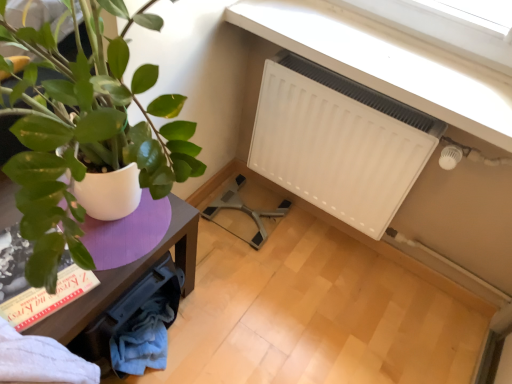
The height and width of the screenshot is (384, 512). I want to click on free location above white plastic radiator at upper right (from a real-world perspective), so click(x=397, y=59).